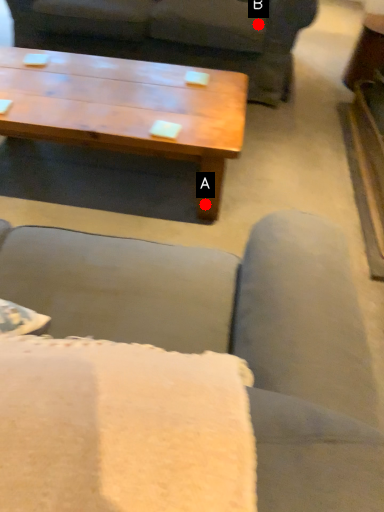
Question: Two points are circled on the image, labeled by A and B beside each circle. Among these points, which one is farthest from the camera?

Choices:
 (A) A is further
 (B) B is further

Answer: (B)